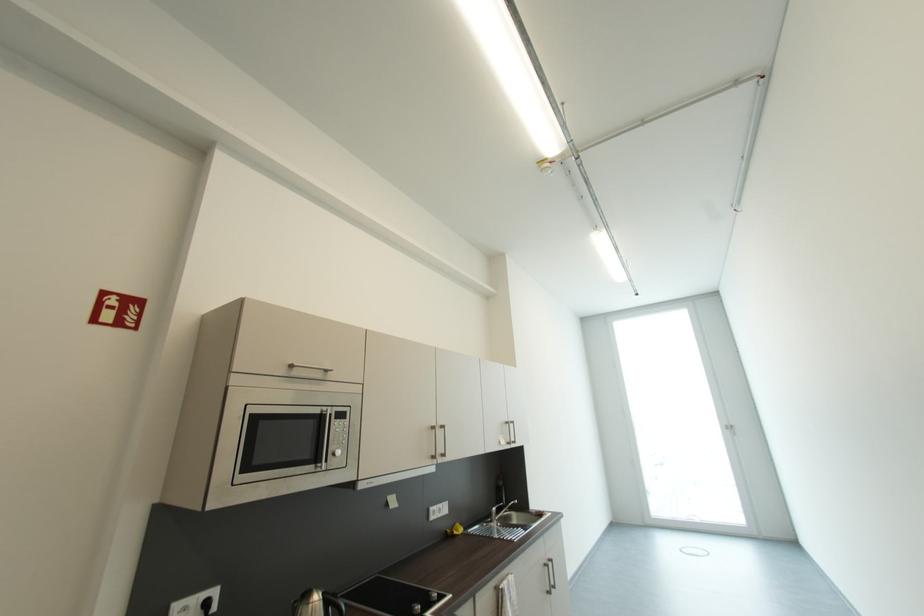
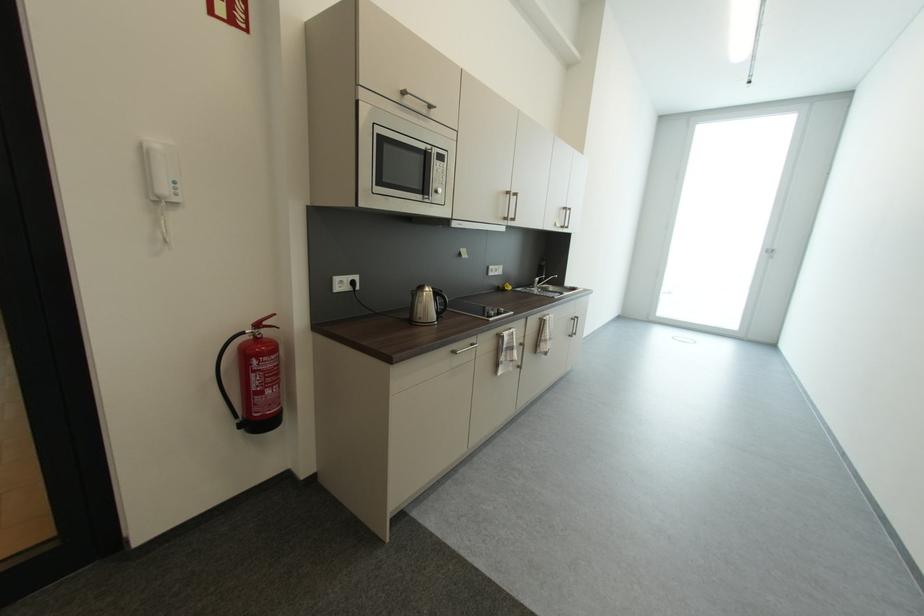
Question: How did the camera likely rotate?

Choices:
 (A) Left
 (B) Right
 (C) Up
 (D) Down

Answer: (D)